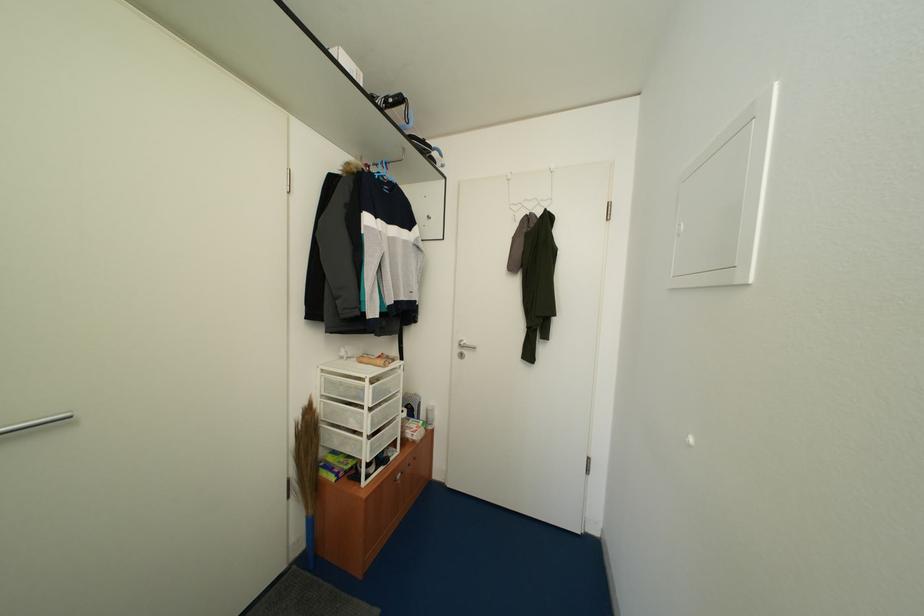
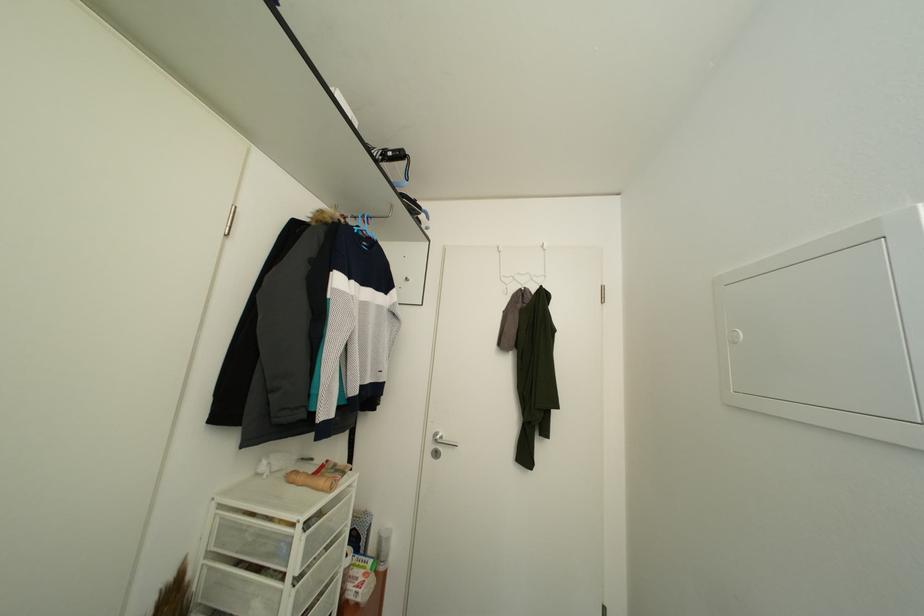
Question: How did the camera likely rotate?

Choices:
 (A) Left
 (B) Right
 (C) Up
 (D) Down

Answer: (C)